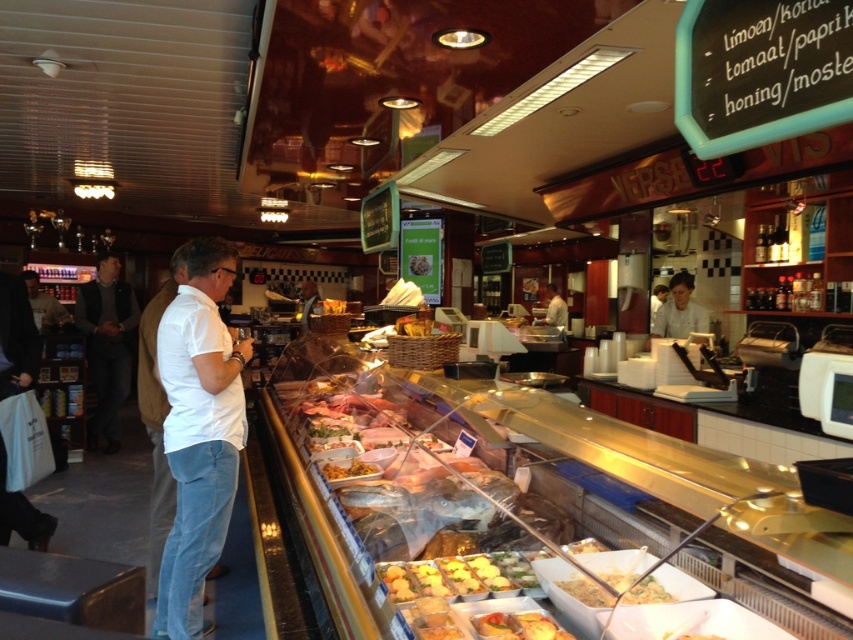
Is white uniform at upper right positioned behind white shirt at center?

No.

Does white uniform at upper right have a smaller size compared to white shirt at center?

Correct, white uniform at upper right occupies less space than white shirt at center.

Who is more distant from viewer, (672,330) or (556,324)?

Positioned behind is point (556,324).

The image size is (853, 640). Find the location of `white uniform at upper right`. white uniform at upper right is located at coordinates (679, 310).

How distant is dark gray sweater at left from golden crispy fries at center?

6.56 meters

In the scene shown: Who is positioned more to the left, dark gray sweater at left or golden crispy fries at center?

dark gray sweater at left

Where is `dark gray sweater at left`? Image resolution: width=853 pixels, height=640 pixels. dark gray sweater at left is located at coordinates (106, 344).

You are a GUI agent. You are given a task and a screenshot of the screen. Output one action in this format:
    pyautogui.click(x=<x>, y=<y>)
    Task: Click on the dark gray sweater at left
    Image resolution: width=853 pixels, height=640 pixels.
    Given the screenshot: What is the action you would take?
    pyautogui.click(x=106, y=344)

Does dark gray sweater at left lie behind white uniform at upper right?

Yes, it is.

Is point (129, 312) positioned after point (693, 317)?

Yes, point (129, 312) is farther from viewer.

Which is behind, point (111, 316) or point (701, 307)?

The point (111, 316) is behind.

Find the location of `dark gray sweater at left`. dark gray sweater at left is located at coordinates (106, 344).